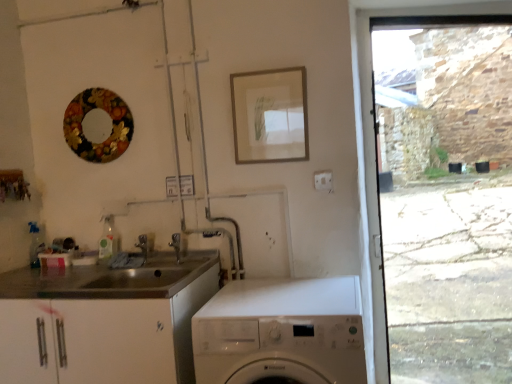
Locate an element on the screen. This screenshot has width=512, height=384. free space in front of metallic silver faucet at upper center, the 2th tap in the back-to-front sequence is located at coordinates (169, 276).